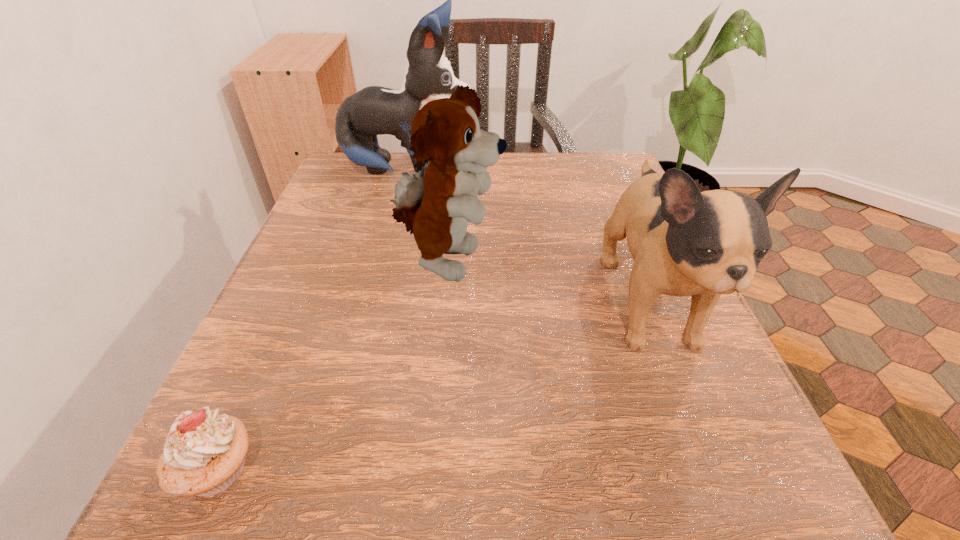
The width and height of the screenshot is (960, 540). I want to click on cupcake that is positioned at the left edge, so click(x=204, y=453).

You are a GUI agent. You are given a task and a screenshot of the screen. Output one action in this format:
    pyautogui.click(x=<x>, y=<y>)
    Task: Click on the object located at the right edge
    The width and height of the screenshot is (960, 540).
    Given the screenshot: What is the action you would take?
    pyautogui.click(x=684, y=242)

At what (x,y) coordinates should I click in order to perform the action: click on object at the far left corner. Please return your answer as a coordinate pair (x, y). Looking at the image, I should click on (374, 110).

Image resolution: width=960 pixels, height=540 pixels. I want to click on object positioned at the near left corner, so click(x=204, y=453).

Find the location of `free space at the far edge of the desktop`. free space at the far edge of the desktop is located at coordinates (504, 186).

In the image, there is a desktop. What are the coordinates of `vacant space at the near edge` in the screenshot? It's located at (532, 524).

You are a GUI agent. You are given a task and a screenshot of the screen. Output one action in this format:
    pyautogui.click(x=<x>, y=<y>)
    Task: Click on the free region at the left edge of the desktop
    Image resolution: width=960 pixels, height=540 pixels.
    Given the screenshot: What is the action you would take?
    pyautogui.click(x=252, y=393)

In the image, there is a desktop. At what (x,y) coordinates should I click in order to perform the action: click on vacant space at the right edge. Please return your answer as a coordinate pair (x, y). Looking at the image, I should click on (673, 356).

Where is `free space at the far left corner of the desktop`? This screenshot has width=960, height=540. free space at the far left corner of the desktop is located at coordinates (401, 162).

Locate an element on the screen. The image size is (960, 540). free space at the near left corner is located at coordinates (205, 497).